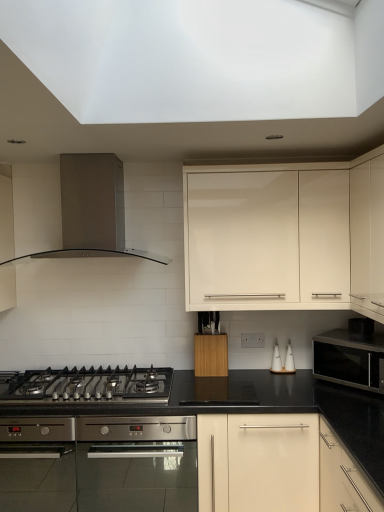
Question: Considering the relative positions of white ceramic salt and pepper shakers at center-right, the 1th appliance in the right-to-left sequence, and black stainless steel gas stove at lower left in the image provided, is white ceramic salt and pepper shakers at center-right, the 1th appliance in the right-to-left sequence, to the left of black stainless steel gas stove at lower left from the viewer's perspective?

Choices:
 (A) no
 (B) yes

Answer: (A)

Question: From a real-world perspective, is white ceramic salt and pepper shakers at center-right, the 1th appliance in the right-to-left sequence, below black stainless steel gas stove at lower left?

Choices:
 (A) no
 (B) yes

Answer: (A)

Question: Is white ceramic salt and pepper shakers at center-right, the second appliance viewed from the left, next to black stainless steel gas stove at lower left and touching it?

Choices:
 (A) no
 (B) yes

Answer: (A)

Question: Could you tell me if white ceramic salt and pepper shakers at center-right, the second appliance viewed from the left, is turned towards black stainless steel gas stove at lower left?

Choices:
 (A) no
 (B) yes

Answer: (A)

Question: Is white ceramic salt and pepper shakers at center-right, the 1th appliance in the right-to-left sequence, far away from black stainless steel gas stove at lower left?

Choices:
 (A) no
 (B) yes

Answer: (B)

Question: From their relative heights in the image, would you say white glossy cabinet at upper center, placed as the 2th cabinetry when sorted from right to left, is taller or shorter than wooden block at center, the 3th cabinetry in the right-to-left sequence?

Choices:
 (A) short
 (B) tall

Answer: (B)

Question: From the image's perspective, is white glossy cabinet at upper center, the second cabinetry viewed from the left, positioned above or below wooden block at center, the 3th cabinetry in the right-to-left sequence?

Choices:
 (A) above
 (B) below

Answer: (A)

Question: Is point (350, 297) closer or farther from the camera than point (193, 362)?

Choices:
 (A) closer
 (B) farther

Answer: (A)

Question: In terms of width, does white glossy cabinet at upper center, placed as the 2th cabinetry when sorted from right to left, look wider or thinner when compared to wooden block at center, the first cabinetry positioned from the left?

Choices:
 (A) wide
 (B) thin

Answer: (A)

Question: From a real-world perspective, is white ceramic salt and pepper shakers at center-right, the 1th appliance in the right-to-left sequence, positioned above or below matte cream cabinet at upper right, the 3th cabinetry viewed from the left?

Choices:
 (A) above
 (B) below

Answer: (B)

Question: Relative to matte cream cabinet at upper right, the 3th cabinetry viewed from the left, is white ceramic salt and pepper shakers at center-right, the 1th appliance in the right-to-left sequence, in front or behind?

Choices:
 (A) behind
 (B) front

Answer: (A)

Question: In terms of height, does white ceramic salt and pepper shakers at center-right, the 1th appliance in the right-to-left sequence, look taller or shorter compared to matte cream cabinet at upper right, the 3th cabinetry viewed from the left?

Choices:
 (A) short
 (B) tall

Answer: (A)

Question: Is point (286, 368) positioned closer to the camera than point (357, 211)?

Choices:
 (A) closer
 (B) farther

Answer: (B)

Question: From their relative heights in the image, would you say white ceramic salt shaker at center-right, the 2th appliance when ordered from right to left, is taller or shorter than wooden block at center, the first cabinetry positioned from the left?

Choices:
 (A) short
 (B) tall

Answer: (A)

Question: From the image's perspective, relative to wooden block at center, the 3th cabinetry in the right-to-left sequence, is white ceramic salt shaker at center-right, the first appliance when ordered from left to right, above or below?

Choices:
 (A) above
 (B) below

Answer: (B)